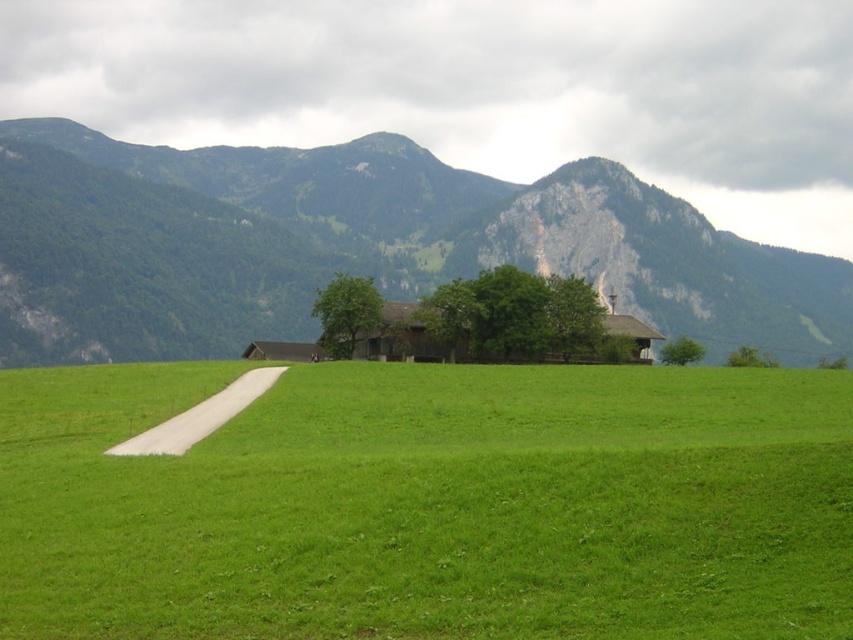
Question: Which point appears closest to the camera in this image?

Choices:
 (A) (252, 381)
 (B) (354, 236)
 (C) (569, 392)

Answer: (C)

Question: Can you confirm if green grassy pasture at center is positioned above green grassy field at lower center?

Choices:
 (A) yes
 (B) no

Answer: (B)

Question: Does green grassy pasture at center have a lesser width compared to white concrete path at lower left?

Choices:
 (A) yes
 (B) no

Answer: (B)

Question: Which is farther from the green grassy field at lower center?

Choices:
 (A) white concrete path at lower left
 (B) green grassy pasture at center

Answer: (A)

Question: Among these points, which one is farthest from the camera?

Choices:
 (A) (227, 394)
 (B) (534, 547)
 (C) (51, 150)

Answer: (C)

Question: Does green grassy pasture at center appear on the left side of green grassy field at lower center?

Choices:
 (A) no
 (B) yes

Answer: (A)